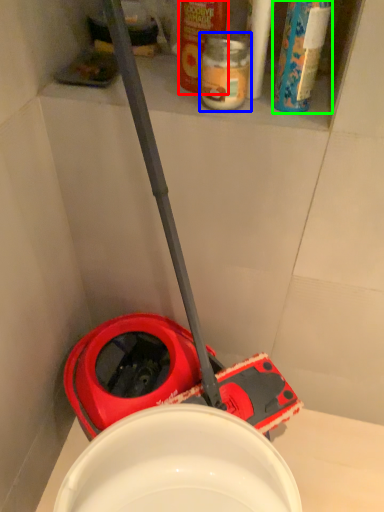
Question: Considering the real-world distances, which object is closest to cleaning product (highlighted by a red box)? bottle (highlighted by a blue box) or cleaning product (highlighted by a green box).

Choices:
 (A) bottle
 (B) cleaning product

Answer: (A)